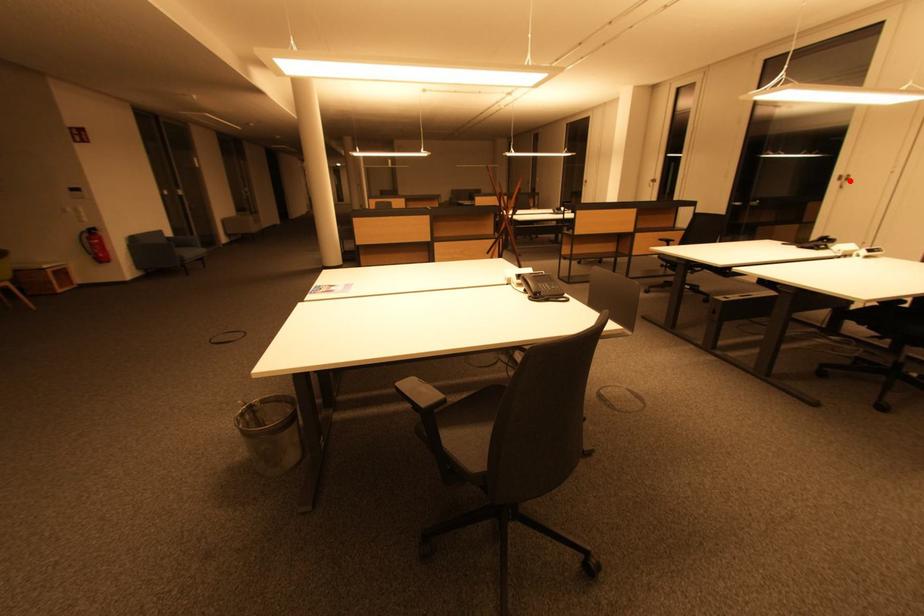
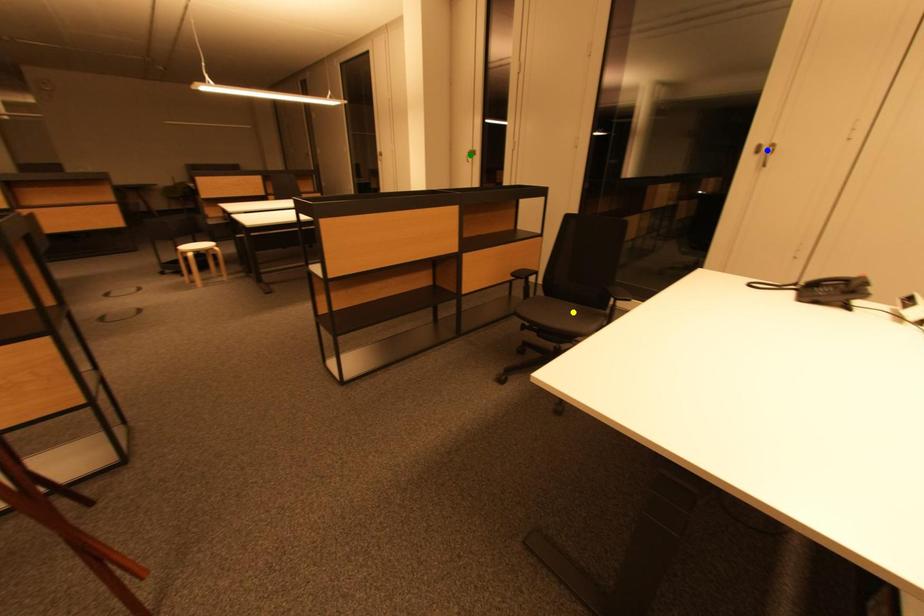
Question: I am providing you with two images of the same scene from different viewpoints. A red point is marked on the first image. You are given multiple points on the second image. Which point in image 2 is actually the same real-world point as the red point in image 1?

Choices:
 (A) green point
 (B) yellow point
 (C) blue point

Answer: (C)